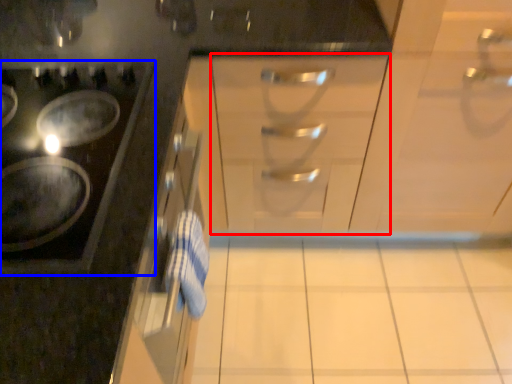
Question: Among these objects, which one is farthest to the camera, drawer (highlighted by a red box) or gas stove (highlighted by a blue box)?

Choices:
 (A) drawer
 (B) gas stove

Answer: (A)